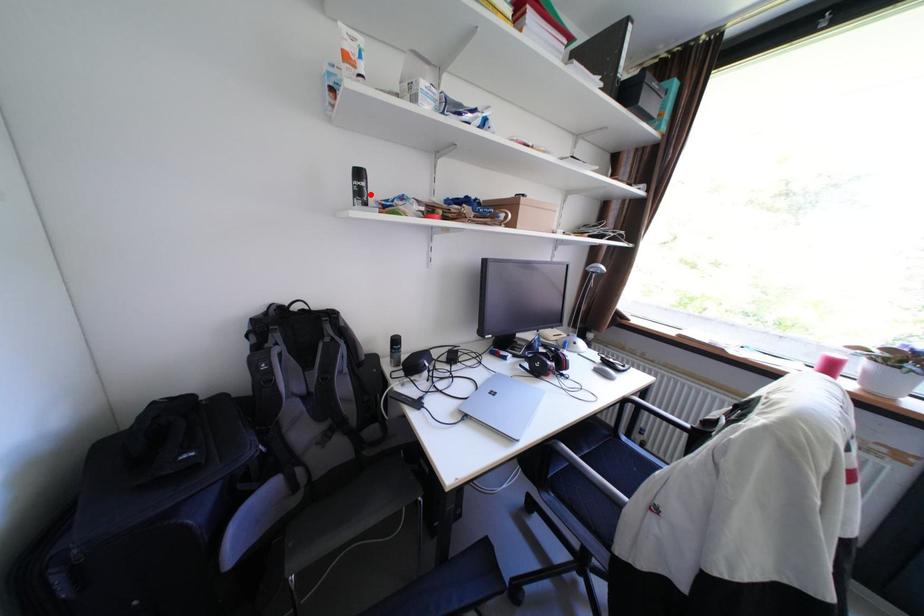
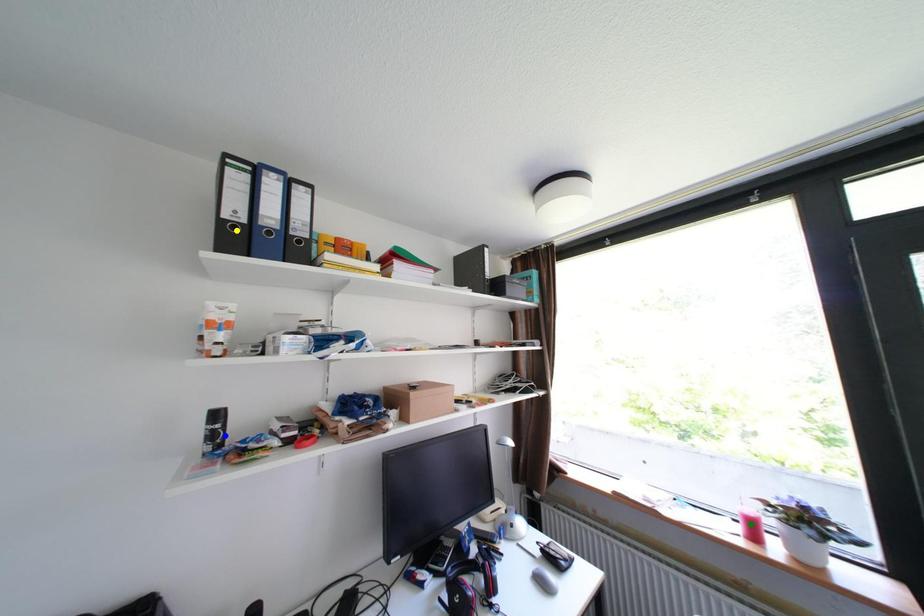
Question: I am providing you with two images of the same scene from different viewpoints. A red point is marked on the first image. You are given multiple points on the second image. In image 2, which mark is for the same physical point as the one in image 1?

Choices:
 (A) yellow point
 (B) green point
 (C) blue point

Answer: (C)